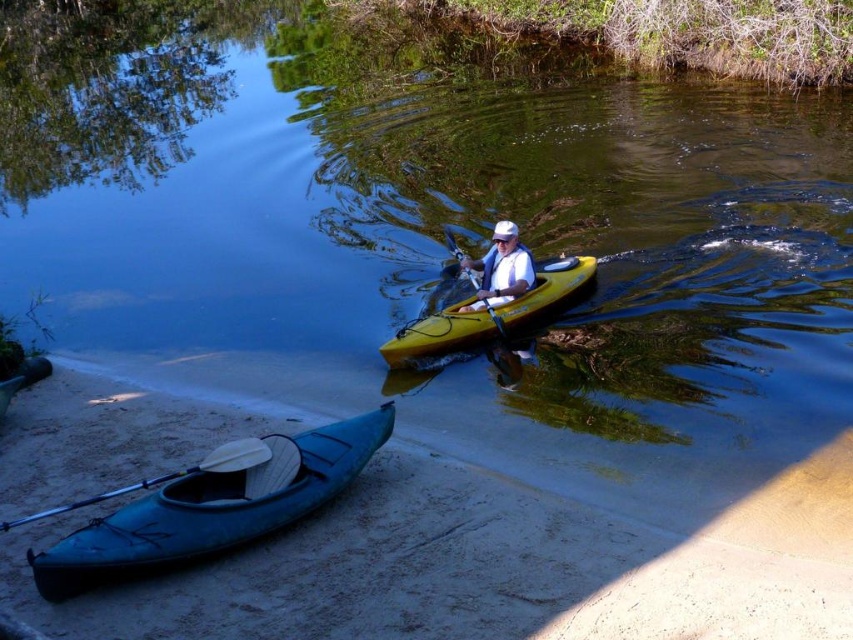
Question: Does sandy shore at lower left come behind yellow matte kayak at center?

Choices:
 (A) yes
 (B) no

Answer: (B)

Question: Based on their relative distances, which object is nearer to the yellow matte kayak at center?

Choices:
 (A) white foam paddle at lower left
 (B) matte yellow kayak at center
 (C) sandy shore at lower left

Answer: (B)

Question: Considering the relative positions of sandy shore at lower left and white foam paddle at lower left in the image provided, where is sandy shore at lower left located with respect to white foam paddle at lower left?

Choices:
 (A) right
 (B) left

Answer: (A)

Question: Based on their relative distances, which object is nearer to the sandy shore at lower left?

Choices:
 (A) white foam paddle at lower left
 (B) teal plastic canoe at lower left
 (C) yellow matte kayak at center
 (D) matte yellow kayak at center

Answer: (B)

Question: Is yellow matte kayak at center further to the viewer compared to matte yellow kayak at center?

Choices:
 (A) yes
 (B) no

Answer: (B)

Question: Which object is farther from the camera taking this photo?

Choices:
 (A) teal plastic canoe at lower left
 (B) sandy shore at lower left
 (C) white foam paddle at lower left

Answer: (C)